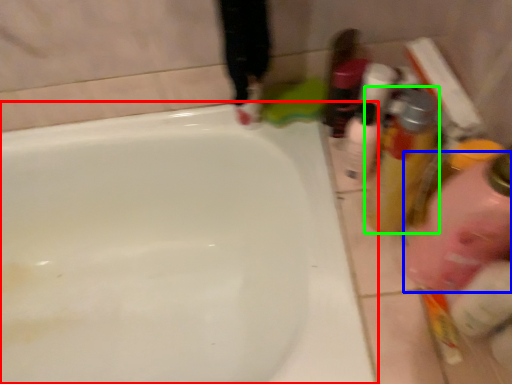
Question: Considering the real-world distances, which object is farthest from bathtub (highlighted by a red box)? cleaning product (highlighted by a blue box) or mouthwash (highlighted by a green box)?

Choices:
 (A) cleaning product
 (B) mouthwash

Answer: (A)